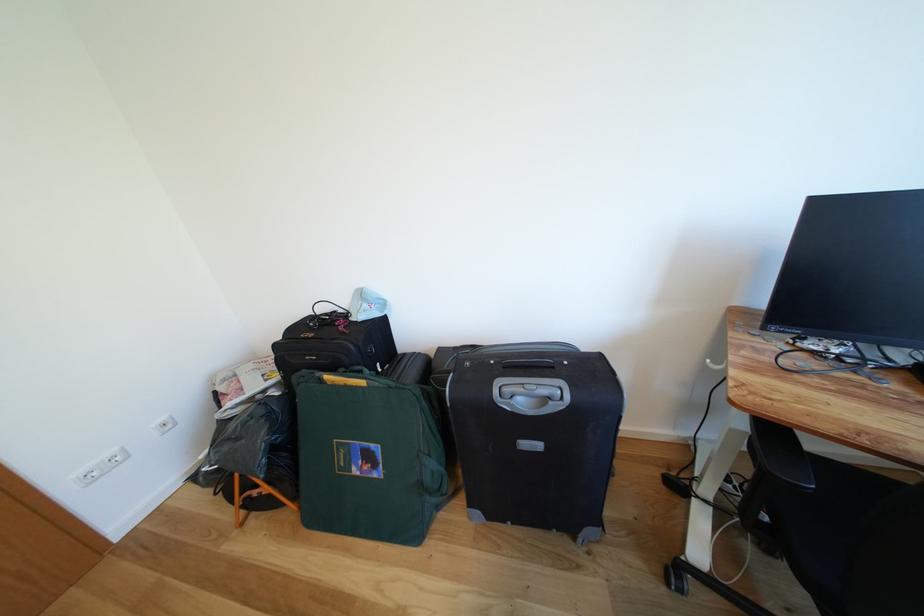
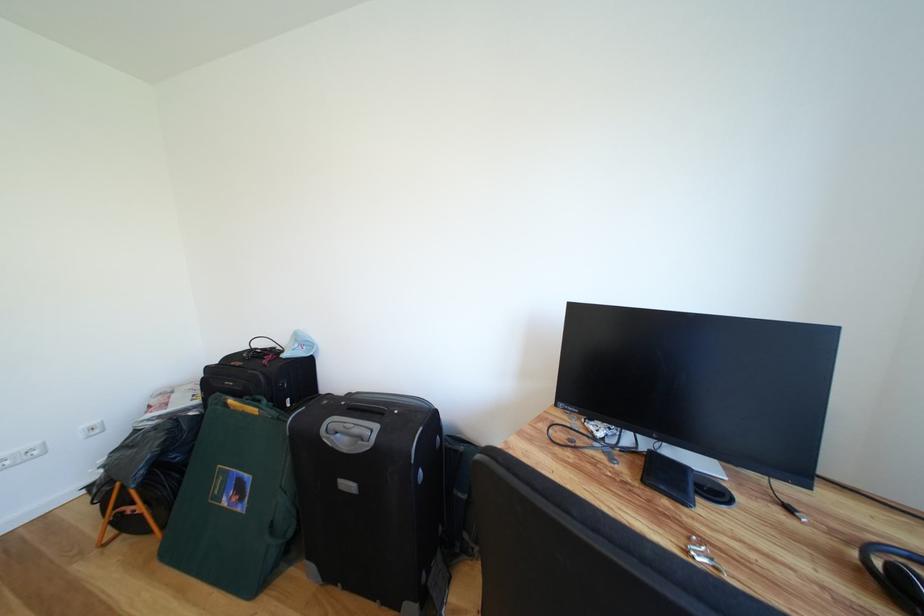
Find the pixel in the second image that matches point (372, 310) in the first image.

(305, 350)